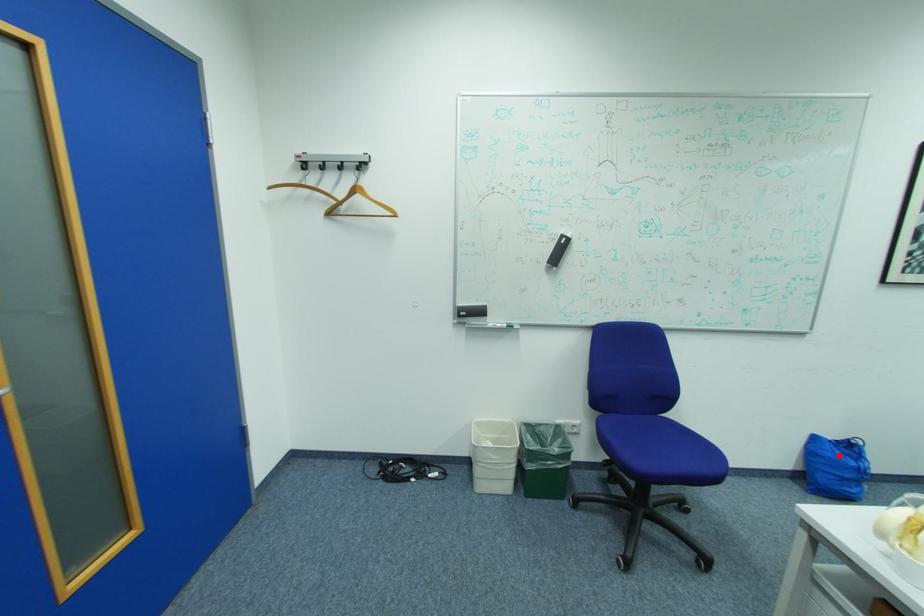
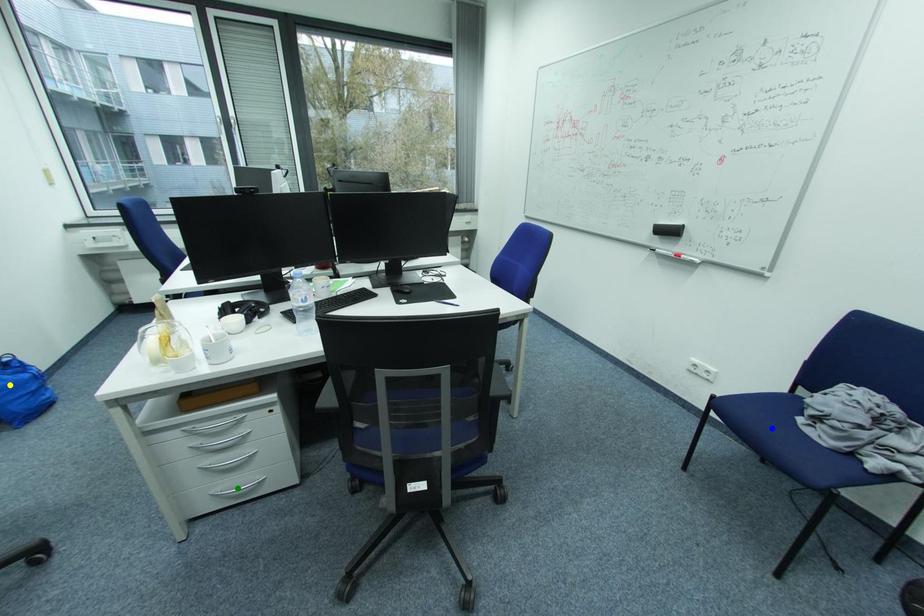
Question: I am providing you with two images of the same scene from different viewpoints. A red point is marked on the first image. You are given multiple points on the second image. Which spot in image 2 lines up with the point in image 1?

Choices:
 (A) green point
 (B) blue point
 (C) yellow point

Answer: (C)